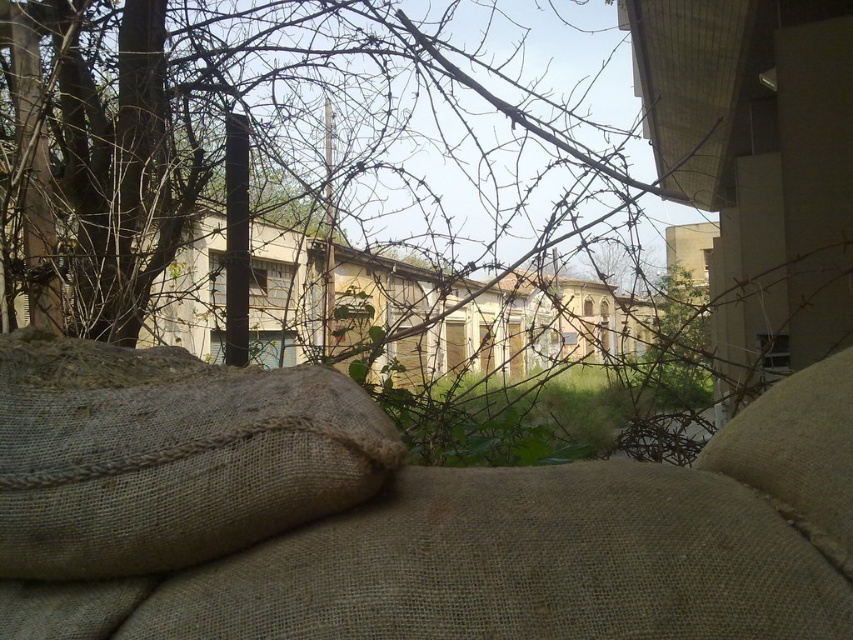
Question: Does burlap sack at lower center have a greater width compared to burlap sack at lower left?

Choices:
 (A) yes
 (B) no

Answer: (A)

Question: Where is brown rough tree at upper left located in relation to burlap sack at lower left in the image?

Choices:
 (A) below
 (B) above

Answer: (B)

Question: Considering the relative positions of burlap sack at lower left and burlap pillow at center in the image provided, where is burlap sack at lower left located with respect to burlap pillow at center?

Choices:
 (A) above
 (B) below

Answer: (A)

Question: Which point is farther from the camera taking this photo?

Choices:
 (A) (10, 364)
 (B) (120, 301)
 (C) (120, 404)
 (D) (712, 460)

Answer: (B)

Question: Which point is farther to the camera?

Choices:
 (A) burlap pillow at center
 (B) brown rough tree at upper left
 (C) burlap sack at lower left
 (D) burlap sack at lower center

Answer: (B)

Question: Among these objects, which one is nearest to the camera?

Choices:
 (A) burlap sack at lower center
 (B) brown rough tree at upper left

Answer: (A)